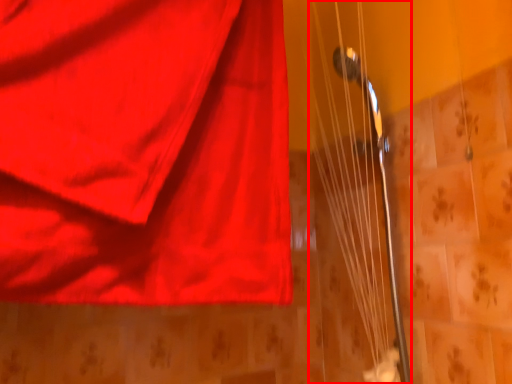
Question: From the image's perspective, what is the correct spatial relationship of string (annotated by the red box) in relation to curtain?

Choices:
 (A) above
 (B) below

Answer: (B)